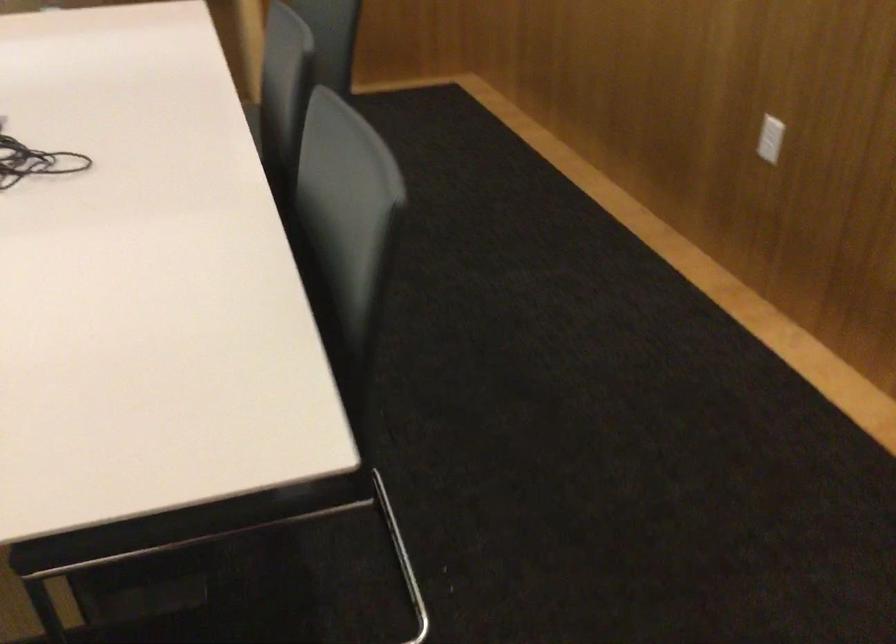
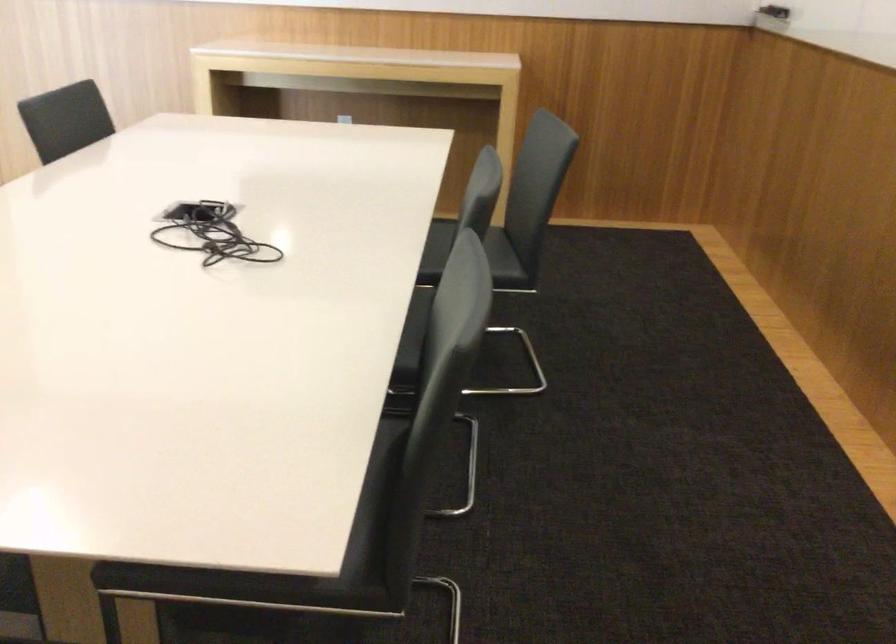
Locate, in the second image, the point that corresponds to [345,115] in the first image.

(470, 256)